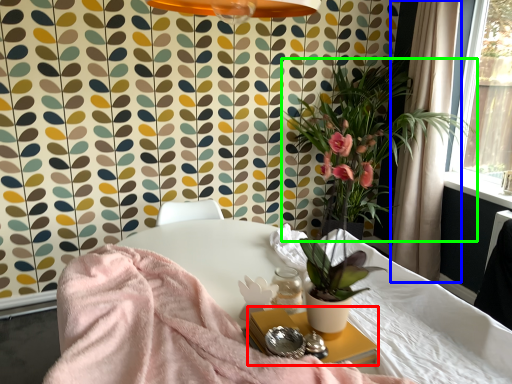
Question: Based on their relative distances, which object is nearer to side table (highlighted by a red box)? Choose from curtain (highlighted by a blue box) and houseplant (highlighted by a green box).

Choices:
 (A) curtain
 (B) houseplant

Answer: (B)